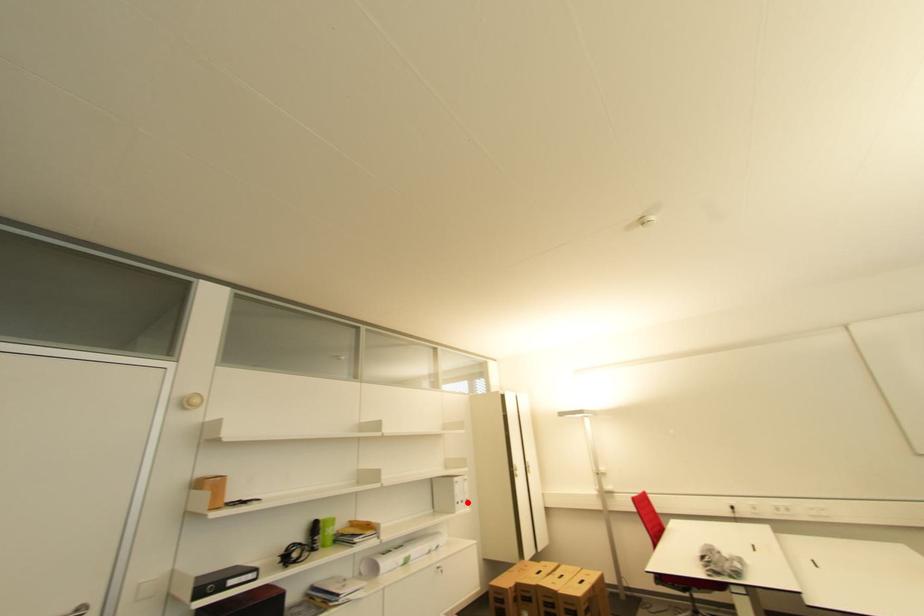
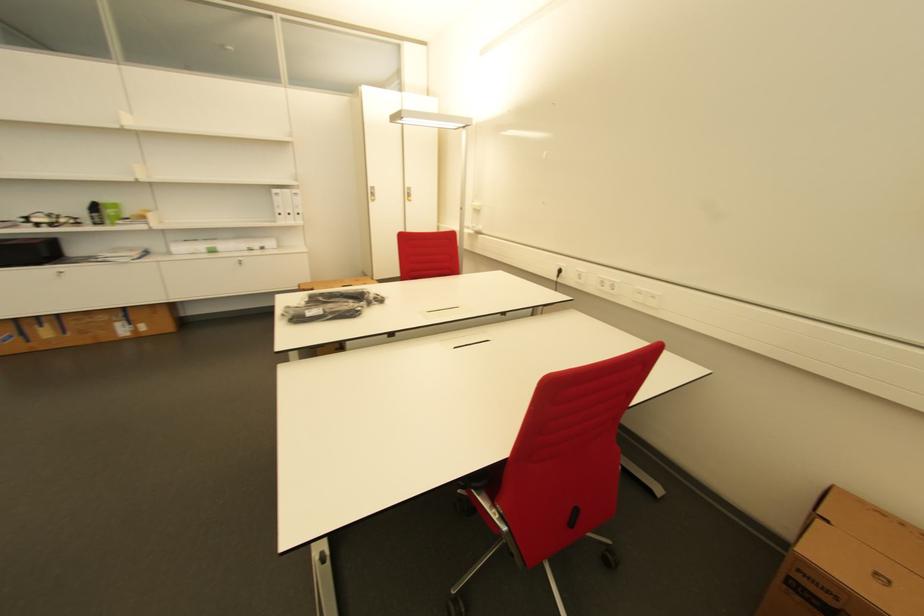
The point at the highlighted location is marked in the first image. Where is the corresponding point in the second image?

(294, 216)